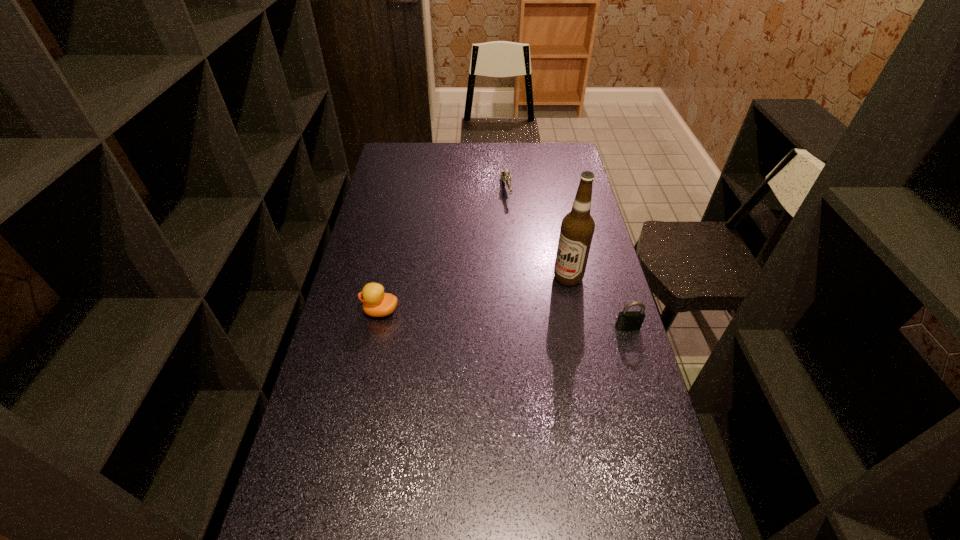
This screenshot has height=540, width=960. Find the location of `free space located 0.180m on the label of the second farthest object`. free space located 0.180m on the label of the second farthest object is located at coordinates (515, 306).

Find the location of a particular element. The height and width of the screenshot is (540, 960). vacant space located on the label of the second farthest object is located at coordinates (470, 328).

Find the location of a particular element. vacant space located on the label of the second farthest object is located at coordinates (531, 296).

At what (x,y) coordinates should I click in order to perform the action: click on free space located 0.230m aimed along the barrel of the farthest object. Please return your answer as a coordinate pair (x, y). Looking at the image, I should click on (516, 240).

You are a GUI agent. You are given a task and a screenshot of the screen. Output one action in this format:
    pyautogui.click(x=<x>, y=<y>)
    Task: Click on the vacant space located aimed along the barrel of the farthest object
    
    Given the screenshot: What is the action you would take?
    pyautogui.click(x=512, y=220)

This screenshot has width=960, height=540. What are the coordinates of `vacant area situated aimed along the barrel of the farthest object` in the screenshot? It's located at (511, 219).

I want to click on object that is at the left edge, so click(x=376, y=303).

Image resolution: width=960 pixels, height=540 pixels. I want to click on padlock that is at the right edge, so click(627, 320).

The width and height of the screenshot is (960, 540). I want to click on alcohol that is positioned at the right edge, so click(x=577, y=228).

You are a GUI agent. You are given a task and a screenshot of the screen. Output one action in this format:
    pyautogui.click(x=<x>, y=<y>)
    Task: Click on the vacant space at the far edge
    This screenshot has height=540, width=960.
    Given the screenshot: What is the action you would take?
    pyautogui.click(x=438, y=147)